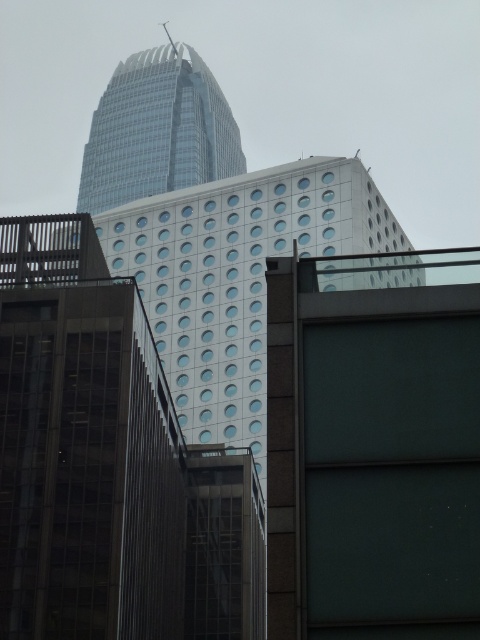
You are a city planner assessing the distance between two key buildings in the urban landscape. The glassy reflective building at center and the transparent glass skyscraper at upper center are both critical to the city layout. Given that the minimum required distance between such structures for safety regulations is 200 meters, does the current spacing meet the safety standards?

The glassy reflective building at center and transparent glass skyscraper at upper center are 187.72 meters apart, which is less than the required 200 meters. Therefore, the current spacing does not meet the safety standards.

You are an architect evaluating the urban layout. Given that the white textured building at center is part of a new development, how does its size compare to the transparent glass skyscraper at upper center in the same image?

The white textured building at center has a larger size compared to the transparent glass skyscraper at upper center, making it the more prominent structure in the scene.

You are an urban planner evaluating the potential for a new public plaza between the glassy reflective building at center and the transparent glass skyscraper at upper center. Based on their sizes, which building would require more space to accommodate safety regulations for construction? Please explain your reasoning.

The transparent glass skyscraper at upper center is larger in size compared to the glassy reflective building at center. Therefore, it would require more space to accommodate safety regulations for construction.